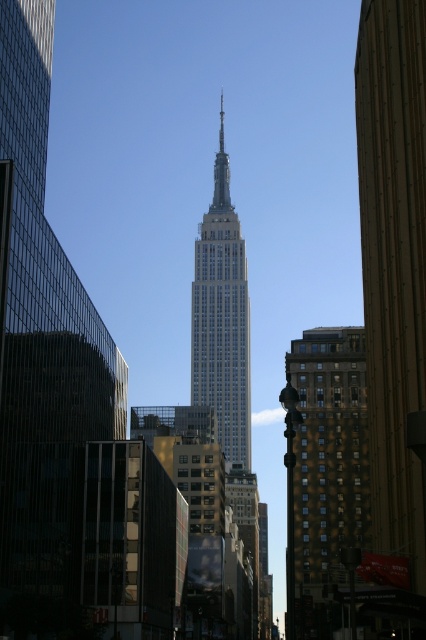
You are a drone operator planning to fly a drone between the brown brick building at right and the polished steel spire at center. The drone has a wingspan of 1.2 meters. Based on the scene, can the drone safely navigate the space between them?

The distance between the brown brick building at right and the polished steel spire at center is 150.02 meters, which is significantly wider than the drone wingspan of 1.2 meters. Yes, the drone can safely navigate the space between them.

You are standing on the sidewalk in front of the Empire State Building and notice the brown brick building at right and the white glass building at center. Which building is closer to you according to their positions?

The brown brick building at right is closer to you because it is positioned in front of the white glass building at center, indicating it is nearer in the line of sight.